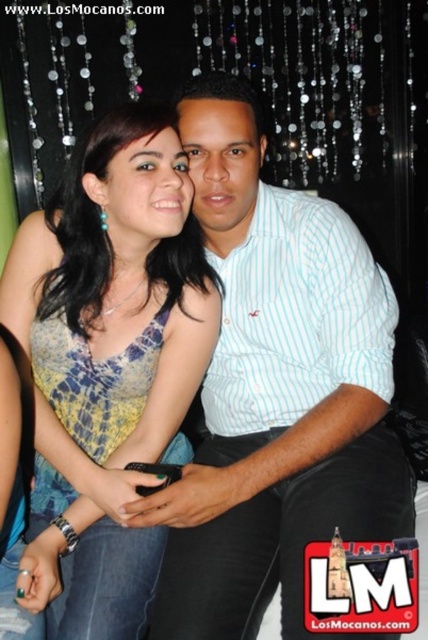
Question: Which point appears farthest from the camera in this image?

Choices:
 (A) (41, 422)
 (B) (391, 506)

Answer: (A)

Question: Is white striped shirt at center below printed fabric dress at center?

Choices:
 (A) no
 (B) yes

Answer: (A)

Question: Does white striped shirt at center appear over printed fabric dress at center?

Choices:
 (A) yes
 (B) no

Answer: (A)

Question: Can you confirm if white striped shirt at center is thinner than printed fabric dress at center?

Choices:
 (A) yes
 (B) no

Answer: (B)